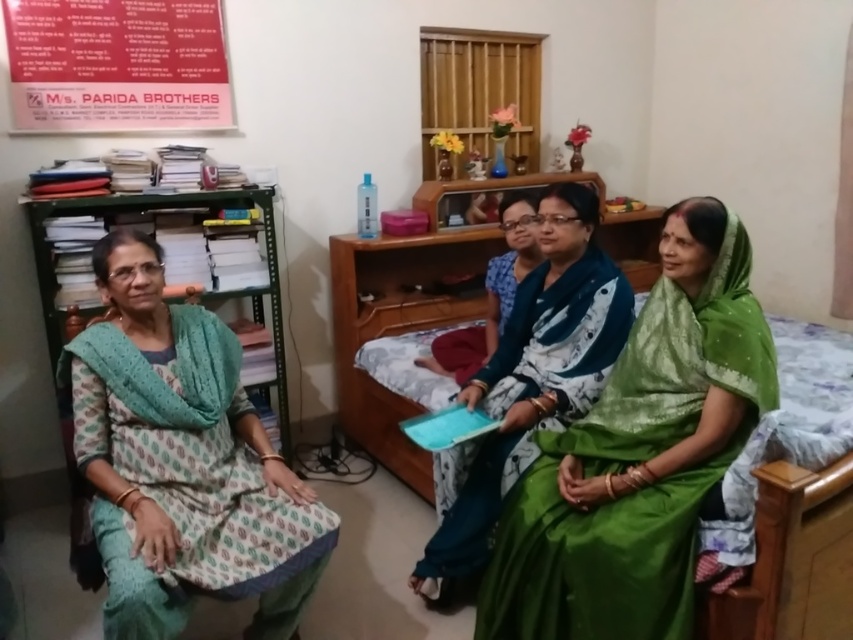
Who is more forward, [665,392] or [157,259]?

Point [665,392] is more forward.

Based on the photo, does green silk saree at center have a smaller size compared to printed cotton dress at left?

Yes, green silk saree at center is smaller than printed cotton dress at left.

Who is more distant from viewer, (671, 284) or (131, 531)?

The point (671, 284) is behind.

Where is `green silk saree at center`? green silk saree at center is located at coordinates (639, 454).

Does printed cotton dress at left have a lesser height compared to silky green saree at center?

Correct, printed cotton dress at left is not as tall as silky green saree at center.

Does point (170, 388) lie behind point (439, 483)?

That is False.

The height and width of the screenshot is (640, 853). In order to click on printed cotton dress at left in this screenshot , I will do `click(183, 461)`.

Is the position of printed cotton dress at left less distant than that of red paper poster at upper left?

Yes.

Is the position of printed cotton dress at left more distant than that of red paper poster at upper left?

No, printed cotton dress at left is in front of red paper poster at upper left.

Identify the location of printed cotton dress at left. (183, 461).

What are the coordinates of `printed cotton dress at left` in the screenshot? It's located at (183, 461).